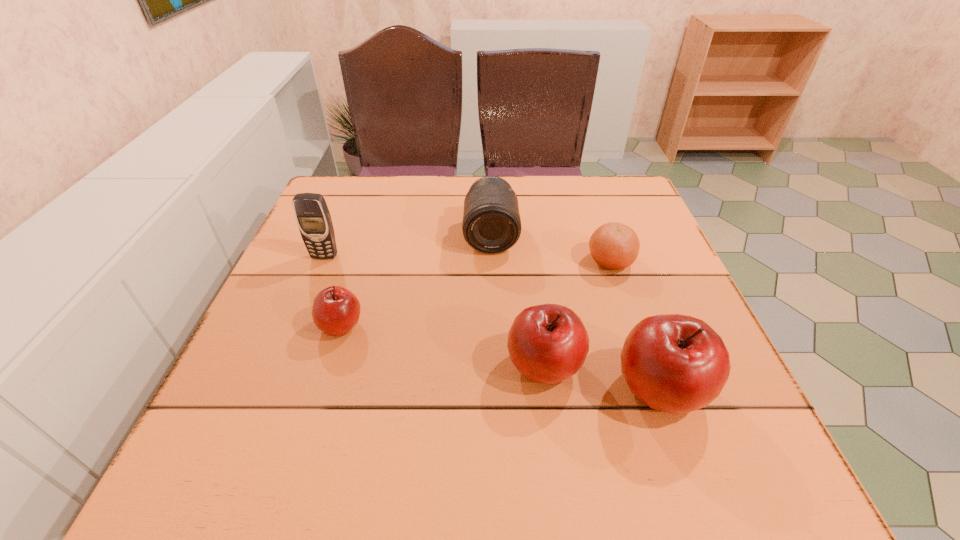
At what (x,y) coordinates should I click in order to perform the action: click on vacant space at the near edge of the desktop. Please return your answer as a coordinate pair (x, y). Looking at the image, I should click on (582, 386).

Where is `free location at the left edge`? The width and height of the screenshot is (960, 540). free location at the left edge is located at coordinates (285, 368).

What are the coordinates of `vacant space at the right edge` in the screenshot? It's located at (659, 234).

Where is `free location at the near left corner`? free location at the near left corner is located at coordinates (266, 424).

Image resolution: width=960 pixels, height=540 pixels. In the image, there is a desktop. Identify the location of vacant space at the far right corner. (635, 185).

Image resolution: width=960 pixels, height=540 pixels. Find the location of `free location at the near right corner`. free location at the near right corner is located at coordinates pyautogui.click(x=743, y=413).

The image size is (960, 540). Identify the location of vacant point located between the second apple from right to left and the rightmost apple. (603, 378).

This screenshot has width=960, height=540. Find the location of `vacant space that's between the cellular telephone and the telephoto lens`. vacant space that's between the cellular telephone and the telephoto lens is located at coordinates (408, 246).

At what (x,y) coordinates should I click in order to perform the action: click on vacant space in between the shortest apple and the second apple from right to left. Please return your answer as a coordinate pair (x, y). Image resolution: width=960 pixels, height=540 pixels. Looking at the image, I should click on (443, 346).

Locate an element on the screen. The image size is (960, 540). vacant space that is in between the cellular telephone and the rightmost apple is located at coordinates coord(492,323).